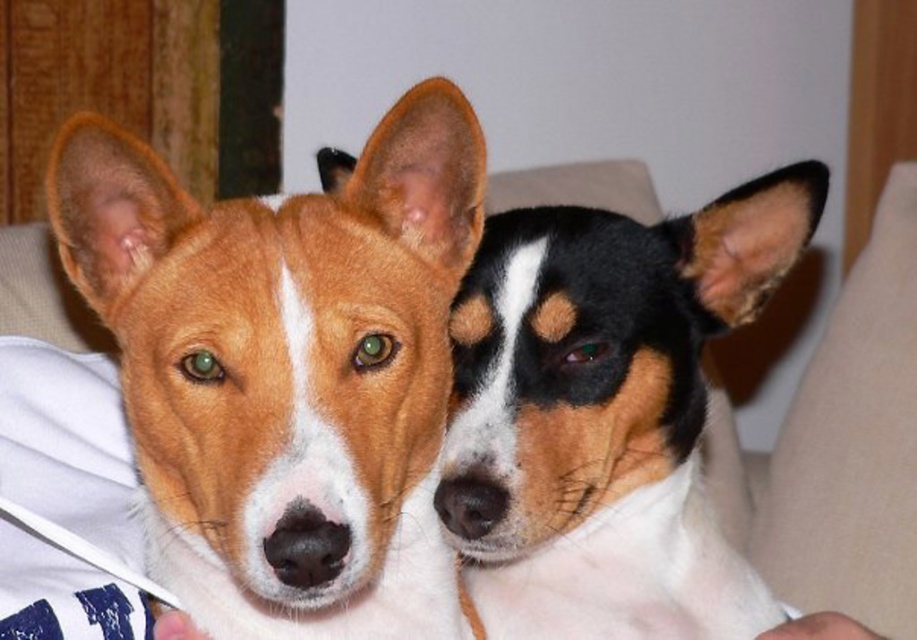
Question: Does brown fur dog at left have a larger size compared to black and white fur at center?

Choices:
 (A) yes
 (B) no

Answer: (B)

Question: Which object appears closest to the camera in this image?

Choices:
 (A) black and white fur at center
 (B) brown fur dog at left

Answer: (B)

Question: Considering the relative positions of brown fur dog at left and black and white fur at center in the image provided, where is brown fur dog at left located with respect to black and white fur at center?

Choices:
 (A) left
 (B) right

Answer: (A)

Question: Which point is farther to the camera?

Choices:
 (A) (681, 566)
 (B) (84, 179)

Answer: (A)

Question: Considering the relative positions of brown fur dog at left and black and white fur at center in the image provided, where is brown fur dog at left located with respect to black and white fur at center?

Choices:
 (A) left
 (B) right

Answer: (A)